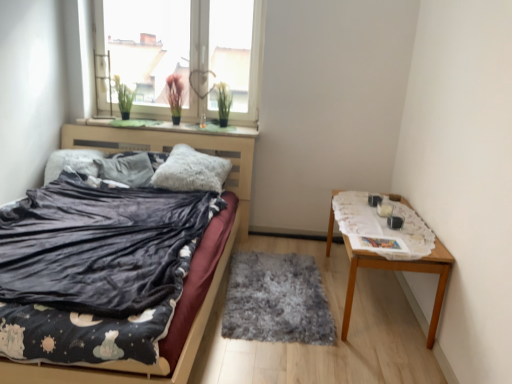
What do you see at coordinates (182, 53) in the screenshot?
I see `transparent glass window at upper center` at bounding box center [182, 53].

The height and width of the screenshot is (384, 512). What do you see at coordinates (192, 265) in the screenshot?
I see `velvet dark blue bed at center` at bounding box center [192, 265].

What do you see at coordinates (383, 225) in the screenshot? The width and height of the screenshot is (512, 384). I see `white lace tablecloth at right` at bounding box center [383, 225].

Describe the element at coordinates (400, 270) in the screenshot. I see `wooden table at right` at that location.

Locate an element on the screen. The image size is (512, 384). fluffy gray pillow at center, acting as the 2th pillow starting from the left is located at coordinates (191, 171).

From the picture: From a real-world perspective, is fluffy gray pillow at center, acting as the 2th pillow starting from the left, positioned over green felt at upper center based on gravity?

No, from a real-world perspective, fluffy gray pillow at center, acting as the 2th pillow starting from the left, is not on top of green felt at upper center.

Considering the sizes of fluffy gray pillow at center, which is counted as the first pillow, starting from the right, and green felt at upper center in the image, is fluffy gray pillow at center, which is counted as the first pillow, starting from the right, wider or thinner than green felt at upper center?

In the image, fluffy gray pillow at center, which is counted as the first pillow, starting from the right, appears to be wider than green felt at upper center.

Which object is closer to the camera taking this photo, fluffy gray pillow at center, which is counted as the first pillow, starting from the right, or green felt at upper center?

fluffy gray pillow at center, which is counted as the first pillow, starting from the right, is in front.

Can you tell me how much fluffy gray pillow at center, which is counted as the first pillow, starting from the right, and green felt at upper center differ in facing direction?

The angular difference between fluffy gray pillow at center, which is counted as the first pillow, starting from the right, and green felt at upper center is 12.2 degrees.

From a real-world perspective, which object stands above the other?

In real-world perspective, fluffy gray pillow at center, which is the second pillow in right-to-left order, is above.

Which is more to the left, fluffy gray pillow at center, which is the second pillow in right-to-left order, or white lace tablecloth at right?

fluffy gray pillow at center, which is the second pillow in right-to-left order.

Considering the points (132, 171) and (342, 198), which point is behind, point (132, 171) or point (342, 198)?

Positioned behind is point (132, 171).

Does point (430, 255) appear closer or farther from the camera than point (415, 257)?

Point (430, 255).

Considering the relative sizes of wooden table at right and white lace tablecloth at right in the image provided, is wooden table at right taller than white lace tablecloth at right?

Correct, wooden table at right is much taller as white lace tablecloth at right.

Can you confirm if wooden table at right is positioned to the left of white lace tablecloth at right?

No, wooden table at right is not to the left of white lace tablecloth at right.

Is wooden table at right turned away from white lace tablecloth at right?

No, wooden table at right's orientation is not away from white lace tablecloth at right.

Based on the photo, does white lace tablecloth at right contain fluffy gray pillow at center, arranged as the 1th pillow when viewed from the left?

No, fluffy gray pillow at center, arranged as the 1th pillow when viewed from the left, is not inside white lace tablecloth at right.

Can you confirm if white lace tablecloth at right is shorter than fluffy gray pillow at center, arranged as the 1th pillow when viewed from the left?

Yes, white lace tablecloth at right is shorter than fluffy gray pillow at center, arranged as the 1th pillow when viewed from the left.

Which object is more forward, white lace tablecloth at right or fluffy gray pillow at center, which is the second pillow in right-to-left order?

Positioned in front is white lace tablecloth at right.

From a real-world perspective, is white lace tablecloth at right above or below fluffy gray pillow at center, arranged as the 1th pillow when viewed from the left?

Clearly, from a real-world perspective, white lace tablecloth at right is below fluffy gray pillow at center, arranged as the 1th pillow when viewed from the left.

Looking at the image, does velvet dark blue bed at center seem bigger or smaller compared to fluffy gray pillow at center, arranged as the 1th pillow when viewed from the left?

Clearly, velvet dark blue bed at center is larger in size than fluffy gray pillow at center, arranged as the 1th pillow when viewed from the left.

Is velvet dark blue bed at center inside the boundaries of fluffy gray pillow at center, which is the second pillow in right-to-left order, or outside?

velvet dark blue bed at center is not enclosed by fluffy gray pillow at center, which is the second pillow in right-to-left order.

Is velvet dark blue bed at center oriented away from fluffy gray pillow at center, arranged as the 1th pillow when viewed from the left?

Yes, fluffy gray pillow at center, arranged as the 1th pillow when viewed from the left, is at the back of velvet dark blue bed at center.

Would you say velvet dark blue bed at center is a long distance from fluffy gray pillow at center, arranged as the 1th pillow when viewed from the left?

No, there isn't a large distance between velvet dark blue bed at center and fluffy gray pillow at center, arranged as the 1th pillow when viewed from the left.

Is velvet dark blue bed at center facing away from fuzzy gray rug at center?

No, velvet dark blue bed at center is not facing the opposite direction of fuzzy gray rug at center.

Is fuzzy gray rug at center located within velvet dark blue bed at center?

No, fuzzy gray rug at center is not inside velvet dark blue bed at center.

Considering the relative sizes of velvet dark blue bed at center and fuzzy gray rug at center in the image provided, is velvet dark blue bed at center shorter than fuzzy gray rug at center?

In fact, velvet dark blue bed at center may be taller than fuzzy gray rug at center.

Which object is further away from the camera, velvet dark blue bed at center or fuzzy gray rug at center?

fuzzy gray rug at center is further from the camera.

Who is bigger, fluffy gray pillow at center, which is counted as the first pillow, starting from the right, or transparent glass window at upper center?

transparent glass window at upper center is bigger.

Is fluffy gray pillow at center, which is counted as the first pillow, starting from the right, in front of or behind transparent glass window at upper center in the image?

fluffy gray pillow at center, which is counted as the first pillow, starting from the right, is in front of transparent glass window at upper center.

Is transparent glass window at upper center a part of fluffy gray pillow at center, acting as the 2th pillow starting from the left?

Actually, transparent glass window at upper center is outside fluffy gray pillow at center, acting as the 2th pillow starting from the left.

Are fluffy gray pillow at center, which is counted as the first pillow, starting from the right, and transparent glass window at upper center far apart?

fluffy gray pillow at center, which is counted as the first pillow, starting from the right, is actually quite close to transparent glass window at upper center.

There is a green felt at upper center. Identify the location of the 1st pillow below it (from a real-world perspective). Image resolution: width=512 pixels, height=384 pixels. (191, 171).

At what (x,y) coordinates should I click in order to perform the action: click on blanket on the right of fluffy gray pillow at center, arranged as the 1th pillow when viewed from the left. Please return your answer as a coordinate pair (x, y). Image resolution: width=512 pixels, height=384 pixels. Looking at the image, I should click on (383, 225).

When comparing their distances from velvet dark blue bed at center, does fluffy gray pillow at center, acting as the 2th pillow starting from the left, or fluffy gray pillow at center, which is the second pillow in right-to-left order, seem further?

fluffy gray pillow at center, which is the second pillow in right-to-left order, lies further to velvet dark blue bed at center than the other object.

Looking at the image, which one is located further to velvet dark blue bed at center, wooden table at right or fluffy gray pillow at center, acting as the 2th pillow starting from the left?

wooden table at right is further to velvet dark blue bed at center.

From the picture: From the image, which object appears to be farther from velvet dark blue bed at center, green felt at upper center or fluffy gray pillow at center, which is counted as the first pillow, starting from the right?

Among the two, green felt at upper center is located further to velvet dark blue bed at center.

Looking at the image, which one is located further to fluffy gray pillow at center, arranged as the 1th pillow when viewed from the left, green felt at upper center or fluffy gray pillow at center, which is counted as the first pillow, starting from the right?

Among the two, green felt at upper center is located further to fluffy gray pillow at center, arranged as the 1th pillow when viewed from the left.

From the picture: Considering their positions, is fuzzy gray rug at center positioned closer to velvet dark blue bed at center than fluffy gray pillow at center, acting as the 2th pillow starting from the left?

fuzzy gray rug at center.

Which object lies nearer to the anchor point fuzzy gray rug at center, velvet dark blue bed at center or green felt at upper center?

velvet dark blue bed at center lies closer to fuzzy gray rug at center than the other object.

From the picture: Which object lies nearer to the anchor point green felt at upper center, velvet dark blue bed at center or fluffy gray pillow at center, which is counted as the first pillow, starting from the right?

Among the two, fluffy gray pillow at center, which is counted as the first pillow, starting from the right, is located nearer to green felt at upper center.

When comparing their distances from fuzzy gray rug at center, does wooden table at right or velvet dark blue bed at center seem closer?

velvet dark blue bed at center lies closer to fuzzy gray rug at center than the other object.

The width and height of the screenshot is (512, 384). Find the location of `mat between velvet dark blue bed at center and transparent glass window at upper center along the z-axis`. mat between velvet dark blue bed at center and transparent glass window at upper center along the z-axis is located at coordinates (276, 300).

The image size is (512, 384). What are the coordinates of `pillow situated between velvet dark blue bed at center and wooden table at right from left to right` in the screenshot? It's located at (191, 171).

The image size is (512, 384). Find the location of `pillow located between transparent glass window at upper center and wooden table at right in the left-right direction`. pillow located between transparent glass window at upper center and wooden table at right in the left-right direction is located at coordinates (191, 171).

Identify the location of mat situated between velvet dark blue bed at center and wooden table at right from left to right. (276, 300).